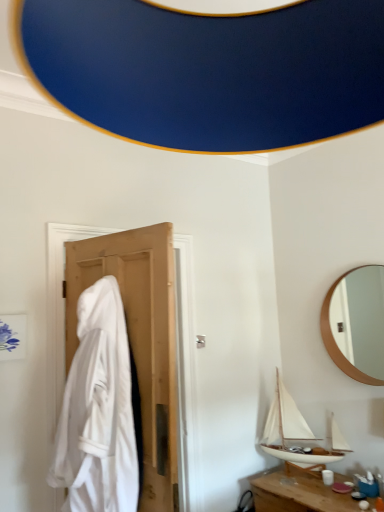
This screenshot has width=384, height=512. Describe the element at coordinates (298, 434) in the screenshot. I see `white wood boat at lower right` at that location.

The width and height of the screenshot is (384, 512). Describe the element at coordinates (139, 338) in the screenshot. I see `white fabric at left` at that location.

Identify the location of wooden round mirror at upper right. (360, 319).

Between wooden round mirror at upper right and white wood boat at lower right, which one has larger size?

white wood boat at lower right.

Is wooden round mirror at upper right situated inside white wood boat at lower right or outside?

wooden round mirror at upper right exists outside the volume of white wood boat at lower right.

Does wooden round mirror at upper right turn towards white wood boat at lower right?

No, wooden round mirror at upper right is not oriented towards white wood boat at lower right.

In the scene shown: Is wooden table at lower right outside of white wood boat at lower right?

Yes, wooden table at lower right is not within white wood boat at lower right.

From a real-world perspective, who is located higher, wooden table at lower right or white wood boat at lower right?

white wood boat at lower right.

From the image's perspective, is wooden table at lower right under white wood boat at lower right?

Yes, from the image's perspective, wooden table at lower right is below white wood boat at lower right.

Does point (296, 508) come closer to viewer compared to point (279, 426)?

Yes, point (296, 508) is in front of point (279, 426).

Which is more to the left, wooden table at lower right or white fabric at left?

From the viewer's perspective, white fabric at left appears more on the left side.

Would you say wooden table at lower right contains white fabric at left?

No.

Which object is closer to the camera taking this photo, wooden table at lower right or white fabric at left?

Positioned in front is white fabric at left.

Considering the sizes of objects wooden table at lower right and white fabric at left in the image provided, who is wider, wooden table at lower right or white fabric at left?

wooden table at lower right.

Can white fabric at left be found inside white wood boat at lower right?

That's incorrect, white fabric at left is not inside white wood boat at lower right.

Can you see white wood boat at lower right touching white fabric at left?

No, white wood boat at lower right is not in contact with white fabric at left.

Image resolution: width=384 pixels, height=512 pixels. I want to click on boat lying on the right of white fabric at left, so click(298, 434).

From a real-world perspective, is white wood boat at lower right physically located above or below white fabric at left?

In terms of real-world spatial position, white wood boat at lower right is below white fabric at left.

In the scene shown: Is wooden round mirror at upper right wider than white fabric at left?

In fact, wooden round mirror at upper right might be narrower than white fabric at left.

Which is in front, point (371, 373) or point (170, 314)?

The point (170, 314) is closer to the camera.

Find the location of a particular element. This screenshot has width=384, height=512. door below the wooden round mirror at upper right (from the image's perspective) is located at coordinates (139, 338).

Is point (336, 329) less distant than point (267, 472)?

No.

Considering the relative sizes of wooden round mirror at upper right and wooden table at lower right in the image provided, is wooden round mirror at upper right smaller than wooden table at lower right?

Yes.

Does wooden round mirror at upper right turn towards wooden table at lower right?

No, wooden round mirror at upper right is not oriented towards wooden table at lower right.

Is wooden table at lower right completely or partially inside wooden round mirror at upper right?

Definitely not — wooden table at lower right is not inside wooden round mirror at upper right.

Does white fabric at left turn towards wooden table at lower right?

No, white fabric at left is not turned towards wooden table at lower right.

Is white fabric at left taller than wooden table at lower right?

Answer: Indeed, white fabric at left has a greater height compared to wooden table at lower right.

Who is bigger, white fabric at left or wooden table at lower right?

Answer: With larger size is white fabric at left.

Where is `boat lying below the wooden round mirror at upper right (from the image's perspective)`? The width and height of the screenshot is (384, 512). boat lying below the wooden round mirror at upper right (from the image's perspective) is located at coordinates (298, 434).

Find the location of a particular element. Image resolution: width=384 pixels, height=512 pixels. table below the white wood boat at lower right (from a real-world perspective) is located at coordinates (296, 492).

When comparing their distances from wooden round mirror at upper right, does white wood boat at lower right or wooden table at lower right seem further?

wooden table at lower right is positioned further to the anchor wooden round mirror at upper right.

When comparing their distances from white wood boat at lower right, does white fabric at left or wooden table at lower right seem further?

white fabric at left.

From the image, which object appears to be farther from white fabric at left, white wood boat at lower right or wooden table at lower right?

white wood boat at lower right lies further to white fabric at left than the other object.

Which object lies nearer to the anchor point white fabric at left, wooden round mirror at upper right or wooden table at lower right?

wooden table at lower right lies closer to white fabric at left than the other object.

Looking at the image, which one is located closer to wooden round mirror at upper right, wooden table at lower right or white fabric at left?

The object closer to wooden round mirror at upper right is wooden table at lower right.

In the scene shown: Considering their positions, is white wood boat at lower right positioned closer to wooden table at lower right than white fabric at left?

white wood boat at lower right.

Looking at this image, from the image, which object appears to be nearer to wooden table at lower right, wooden round mirror at upper right or white fabric at left?

Among the two, white fabric at left is located nearer to wooden table at lower right.

When comparing their distances from white fabric at left, does wooden round mirror at upper right or white wood boat at lower right seem closer?

white wood boat at lower right is positioned closer to the anchor white fabric at left.

Image resolution: width=384 pixels, height=512 pixels. In order to click on boat situated between white fabric at left and wooden table at lower right from left to right in this screenshot , I will do `click(298, 434)`.

Identify the location of table between white fabric at left and wooden round mirror at upper right from left to right. Image resolution: width=384 pixels, height=512 pixels. (296, 492).

Locate an element on the screen. This screenshot has height=512, width=384. boat between white fabric at left and wooden round mirror at upper right from left to right is located at coordinates (298, 434).

This screenshot has height=512, width=384. In order to click on boat between wooden round mirror at upper right and wooden table at lower right vertically in this screenshot , I will do `click(298, 434)`.